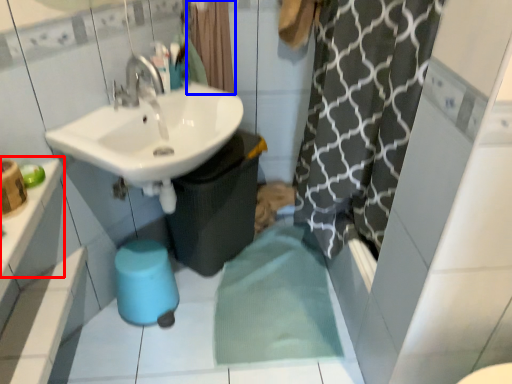
Question: Which object is further to the camera taking this photo, counter top (highlighted by a red box) or shower curtain (highlighted by a blue box)?

Choices:
 (A) counter top
 (B) shower curtain

Answer: (B)